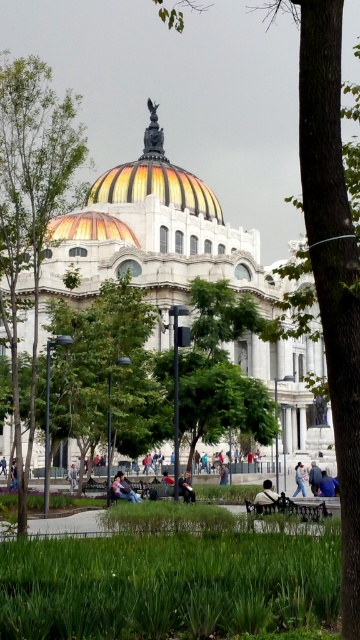
You are standing at the entrance of the grand building with the colorful dome. You notice a point marked at coordinates (167,586). What is located at this point?

The point at coordinates (167,586) corresponds to the green grass at lower center.